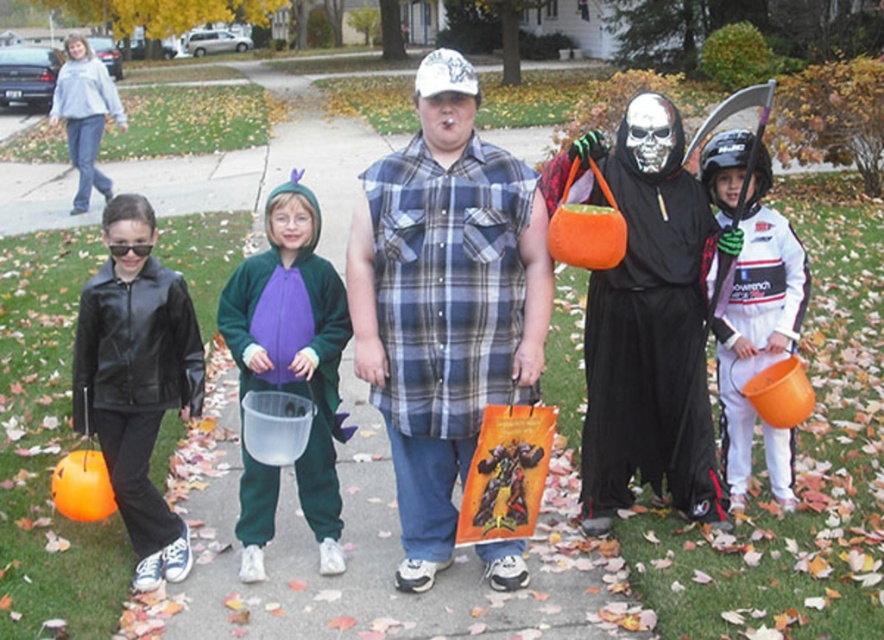
Question: Can you confirm if plaid cotton shirt at center is positioned above white matte helmet at upper right?

Choices:
 (A) no
 (B) yes

Answer: (A)

Question: Which point is closer to the camera?

Choices:
 (A) shiny black leather jacket at left
 (B) white matte helmet at upper right
 (C) black matte robe at center

Answer: (A)

Question: Where is plaid cotton shirt at center located in relation to black matte robe at center in the image?

Choices:
 (A) below
 (B) above

Answer: (A)

Question: Which point is farther from the camera taking this photo?

Choices:
 (A) (111, 401)
 (B) (311, 340)
 (C) (417, 330)
 (D) (786, 252)

Answer: (D)

Question: Is shiny black leather jacket at left behind white matte helmet at upper right?

Choices:
 (A) no
 (B) yes

Answer: (A)

Question: Considering the real-world distances, which object is closest to the black matte robe at center?

Choices:
 (A) shiny black leather jacket at left
 (B) plaid cotton shirt at center
 (C) white matte helmet at upper right

Answer: (C)